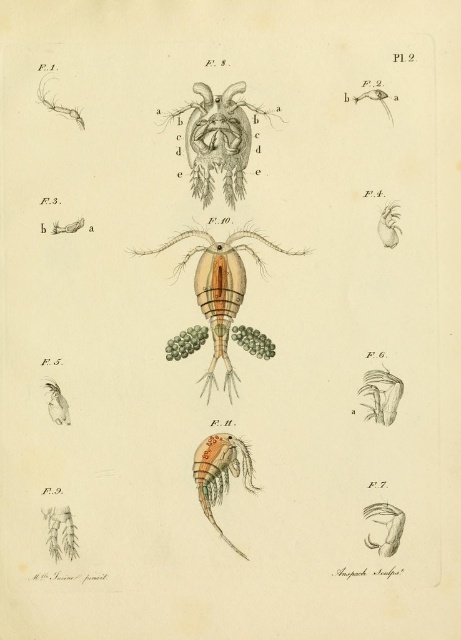
Can you confirm if translucent orange shrimp at lower center is wider than matte white insect at lower left?

Indeed, translucent orange shrimp at lower center has a greater width compared to matte white insect at lower left.

Locate an element on the screen. This screenshot has width=461, height=640. translucent orange shrimp at lower center is located at coordinates (220, 474).

Who is more forward, (x=230, y=472) or (x=57, y=412)?

Point (x=57, y=412)

Image resolution: width=461 pixels, height=640 pixels. In order to click on translucent orange shrimp at lower center in this screenshot , I will do `click(220, 474)`.

Is point (388, 218) farther from viewer compared to point (61, 422)?

Yes, it is.

In the scene shown: How distant is matte yellow insect at upper right from matte white insect at lower left?

matte yellow insect at upper right and matte white insect at lower left are 22.43 inches apart.

Between point (379, 234) and point (65, 403), which one is positioned in front?

Point (65, 403) is more forward.

This screenshot has height=640, width=461. I want to click on matte yellow insect at upper right, so click(x=389, y=225).

Is translucent yellowish-orange shrimp at center below matte yellow insect at upper right?

Correct, translucent yellowish-orange shrimp at center is located below matte yellow insect at upper right.

Who is positioned more to the left, translucent yellowish-orange shrimp at center or matte yellow insect at upper right?

translucent yellowish-orange shrimp at center is more to the left.

Measure the distance between point (204, 276) and camera.

A distance of 1.39 meters exists between point (204, 276) and camera.

This screenshot has height=640, width=461. Find the location of `translucent yellowish-orange shrimp at center`. translucent yellowish-orange shrimp at center is located at coordinates (219, 291).